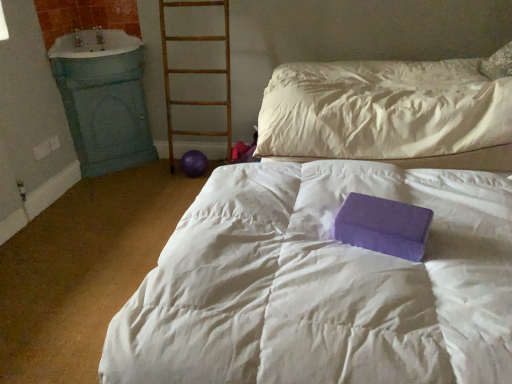
Question: Does purple foam block at center have a larger size compared to purple matte foam block at center?

Choices:
 (A) no
 (B) yes

Answer: (B)

Question: Considering the relative sizes of purple foam block at center and purple matte foam block at center in the image provided, is purple foam block at center shorter than purple matte foam block at center?

Choices:
 (A) no
 (B) yes

Answer: (B)

Question: Considering the relative sizes of purple foam block at center and purple matte foam block at center in the image provided, is purple foam block at center taller than purple matte foam block at center?

Choices:
 (A) yes
 (B) no

Answer: (B)

Question: Can you confirm if purple foam block at center is positioned to the right of purple matte foam block at center?

Choices:
 (A) yes
 (B) no

Answer: (B)

Question: Is purple matte foam block at center at the back of purple foam block at center?

Choices:
 (A) yes
 (B) no

Answer: (B)

Question: Is purple matte foam block at center wider or thinner than purple foam block at center?

Choices:
 (A) wide
 (B) thin

Answer: (B)

Question: Is point (353, 230) positioned closer to the camera than point (377, 177)?

Choices:
 (A) closer
 (B) farther

Answer: (A)

Question: Is purple matte foam block at center bigger or smaller than purple foam block at center?

Choices:
 (A) small
 (B) big

Answer: (A)

Question: From a real-world perspective, relative to purple foam block at center, is purple matte foam block at center vertically above or below?

Choices:
 (A) below
 (B) above

Answer: (B)

Question: In terms of size, does blue painted wood sink at left appear bigger or smaller than wooden ladder at center?

Choices:
 (A) small
 (B) big

Answer: (A)

Question: Considering the positions of point (98, 44) and point (212, 3), is point (98, 44) closer or farther from the camera than point (212, 3)?

Choices:
 (A) farther
 (B) closer

Answer: (A)

Question: In terms of height, does blue painted wood sink at left look taller or shorter compared to wooden ladder at center?

Choices:
 (A) tall
 (B) short

Answer: (B)

Question: Considering the positions of blue painted wood sink at left and wooden ladder at center in the image, is blue painted wood sink at left wider or thinner than wooden ladder at center?

Choices:
 (A) wide
 (B) thin

Answer: (A)

Question: Is point (373, 112) closer or farther from the camera than point (61, 44)?

Choices:
 (A) farther
 (B) closer

Answer: (B)

Question: Considering the positions of purple foam block at center and blue painted wood sink at left in the image, is purple foam block at center wider or thinner than blue painted wood sink at left?

Choices:
 (A) thin
 (B) wide

Answer: (B)